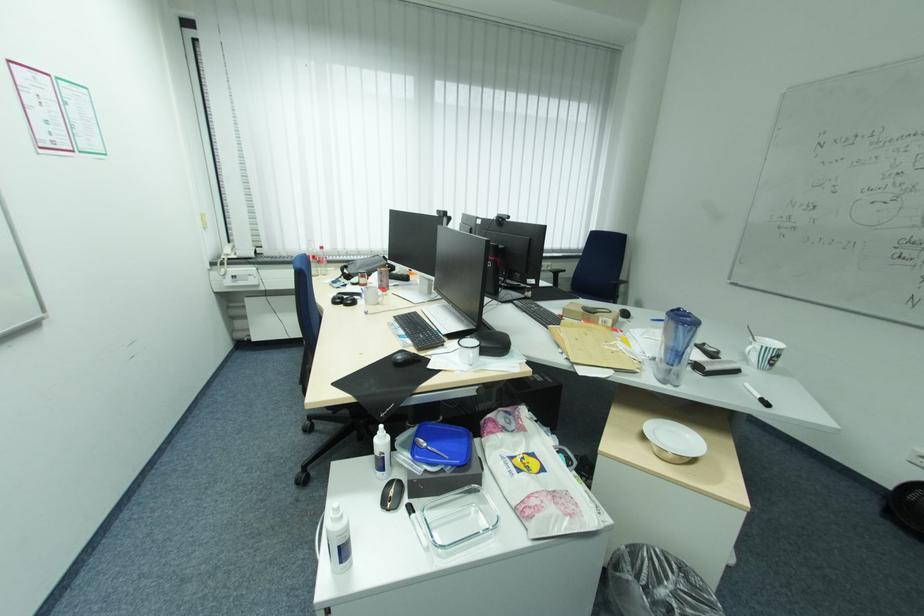
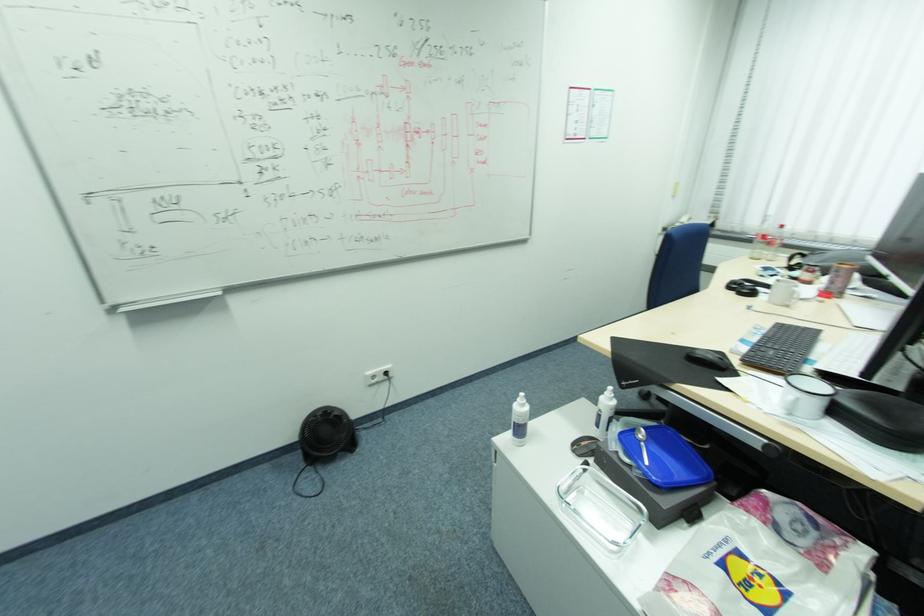
Locate, in the second image, the point that corresponds to pixel 478 355 in the first image.

(796, 397)